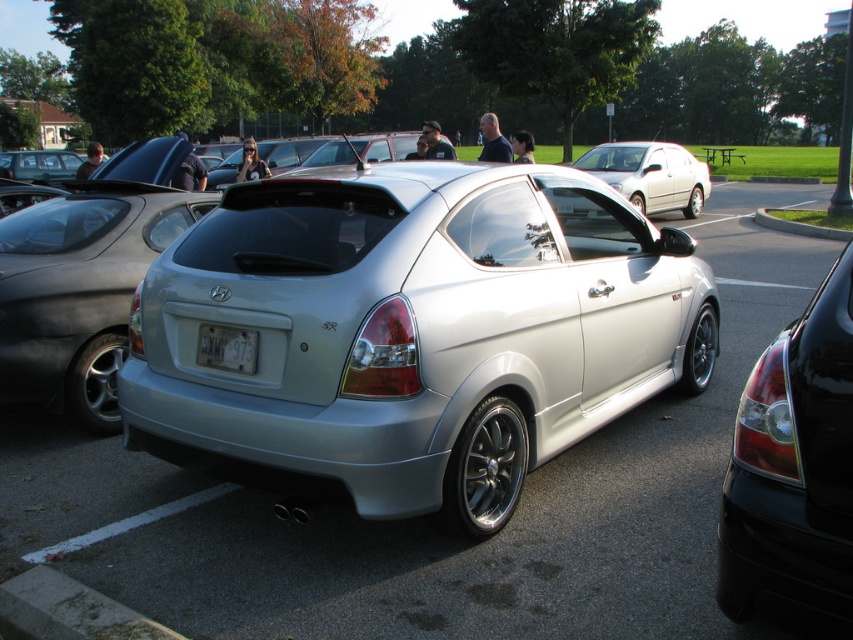
Is point (119, 538) closer to camera compared to point (236, 356)?

No.

Is satin silver car at center closer to camera compared to white plastic license plate at center?

Yes.

The width and height of the screenshot is (853, 640). What do you see at coordinates (426, 518) in the screenshot? I see `satin silver car at center` at bounding box center [426, 518].

Find the location of a particular element. The image size is (853, 640). satin silver car at center is located at coordinates (426, 518).

Is satin silver car at center thinner than matte black sedan at left?

In fact, satin silver car at center might be wider than matte black sedan at left.

Is satin silver car at center bigger than matte black sedan at left?

Yes.

Which is behind, point (183, 612) or point (84, 284)?

The point (84, 284) is more distant.

The width and height of the screenshot is (853, 640). I want to click on satin silver car at center, so click(x=426, y=518).

Is gray concrete curb at lower left shorter than satin silver hatchback at center?

Yes, gray concrete curb at lower left is shorter than satin silver hatchback at center.

The width and height of the screenshot is (853, 640). Describe the element at coordinates (67, 611) in the screenshot. I see `gray concrete curb at lower left` at that location.

Find the location of `gray concrete curb at lower left`. gray concrete curb at lower left is located at coordinates (67, 611).